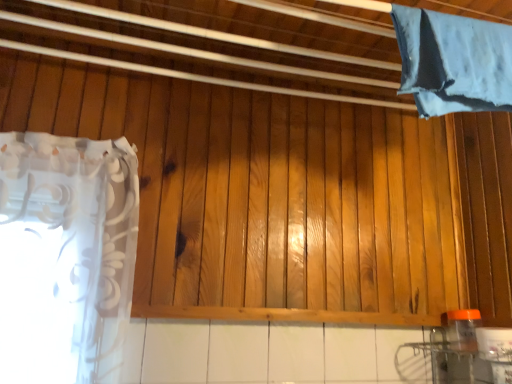
What do you see at coordinates (66, 257) in the screenshot?
I see `white sheer curtain at left, arranged as the 1th curtain when viewed from the left` at bounding box center [66, 257].

What is the approximate width of orange translucent bottle at lower right?

orange translucent bottle at lower right is 2.65 inches in width.

Image resolution: width=512 pixels, height=384 pixels. Find the location of `blue fabric at upper right, the 1th curtain from the top`. blue fabric at upper right, the 1th curtain from the top is located at coordinates (453, 62).

Between white sheer curtain at left, the second curtain from the top, and blue fabric at upper right, which appears as the 1th curtain when viewed from the right, which one has larger size?

With larger size is white sheer curtain at left, the second curtain from the top.

Can you tell me how much white sheer curtain at left, acting as the second curtain starting from the right, and blue fabric at upper right, which appears as the 1th curtain when viewed from the right, differ in facing direction?

There is a 3.81-degree angle between the facing directions of white sheer curtain at left, acting as the second curtain starting from the right, and blue fabric at upper right, which appears as the 1th curtain when viewed from the right.

Is white sheer curtain at left, the second curtain from the top, far from blue fabric at upper right, which appears as the 1th curtain when viewed from the right?

They are positioned close to each other.

From a real-world perspective, who is located lower, orange translucent bottle at lower right or white sheer curtain at left, which ranks as the 1th curtain in bottom-to-top order?

In real-world perspective, orange translucent bottle at lower right is lower.

Considering the points (471, 324) and (66, 228), which point is in front, point (471, 324) or point (66, 228)?

The point (66, 228) is in front.

Measure the distance between orange translucent bottle at lower right and white sheer curtain at left, arranged as the 1th curtain when viewed from the left.

orange translucent bottle at lower right is 39.35 inches away from white sheer curtain at left, arranged as the 1th curtain when viewed from the left.

From the image's perspective, is orange translucent bottle at lower right under white sheer curtain at left, which ranks as the 1th curtain in bottom-to-top order?

Yes.

Locate an element on the screen. bottle lying on the right of white sheer curtain at left, arranged as the 1th curtain when viewed from the left is located at coordinates (463, 329).

From the picture: Which is more to the right, white sheer curtain at left, acting as the second curtain starting from the right, or orange translucent bottle at lower right?

Positioned to the right is orange translucent bottle at lower right.

Is white sheer curtain at left, which ranks as the 1th curtain in bottom-to-top order, oriented away from orange translucent bottle at lower right?

No, white sheer curtain at left, which ranks as the 1th curtain in bottom-to-top order,'s orientation is not away from orange translucent bottle at lower right.

Considering the points (469, 346) and (416, 65), which point is behind, point (469, 346) or point (416, 65)?

Point (469, 346)

Is orange translucent bottle at lower right aimed at blue fabric at upper right, placed as the 2th curtain when sorted from left to right?

No, orange translucent bottle at lower right does not turn towards blue fabric at upper right, placed as the 2th curtain when sorted from left to right.

Considering the relative sizes of orange translucent bottle at lower right and blue fabric at upper right, placed as the 2th curtain when sorted from left to right, in the image provided, is orange translucent bottle at lower right smaller than blue fabric at upper right, placed as the 2th curtain when sorted from left to right,?

Yes.

From a real-world perspective, is blue fabric at upper right, which appears as the 1th curtain when viewed from the right, below white sheer curtain at left, acting as the second curtain starting from the right?

No, from a real-world perspective, blue fabric at upper right, which appears as the 1th curtain when viewed from the right, is not below white sheer curtain at left, acting as the second curtain starting from the right.

From the image's perspective, is blue fabric at upper right, which appears as the 1th curtain when viewed from the right, on top of white sheer curtain at left, which ranks as the 1th curtain in bottom-to-top order?

Correct, blue fabric at upper right, which appears as the 1th curtain when viewed from the right, appears higher than white sheer curtain at left, which ranks as the 1th curtain in bottom-to-top order, in the image.

Does blue fabric at upper right, the 1th curtain from the top, have a smaller size compared to white sheer curtain at left, which ranks as the 1th curtain in bottom-to-top order?

Yes.

Which object is further away from the camera, blue fabric at upper right, placed as the 2th curtain when sorted from left to right, or orange translucent bottle at lower right?

orange translucent bottle at lower right.

Considering the points (490, 63) and (470, 311), which point is in front, point (490, 63) or point (470, 311)?

The point (490, 63) is closer to the camera.

In the scene shown: Does blue fabric at upper right, the 1th curtain from the top, have a lesser height compared to orange translucent bottle at lower right?

No.

Find the location of a particular element. The width and height of the screenshot is (512, 384). bottle lying below the blue fabric at upper right, the 1th curtain from the top (from the image's perspective) is located at coordinates (463, 329).

I want to click on curtain to the right of white sheer curtain at left, arranged as the 1th curtain when viewed from the left, so click(x=453, y=62).

At what (x,y) coordinates should I click in order to perform the action: click on bottle behind the white sheer curtain at left, the second curtain from the top. Please return your answer as a coordinate pair (x, y). The width and height of the screenshot is (512, 384). Looking at the image, I should click on (463, 329).

Which object lies further to the anchor point orange translucent bottle at lower right, blue fabric at upper right, the 1th curtain from the top, or white sheer curtain at left, acting as the second curtain starting from the right?

white sheer curtain at left, acting as the second curtain starting from the right, lies further to orange translucent bottle at lower right than the other object.

From the image, which object appears to be nearer to blue fabric at upper right, acting as the second curtain starting from the bottom, white sheer curtain at left, the second curtain from the top, or orange translucent bottle at lower right?

orange translucent bottle at lower right is positioned closer to the anchor blue fabric at upper right, acting as the second curtain starting from the bottom.

Consider the image. Which object lies nearer to the anchor point blue fabric at upper right, the 1th curtain from the top, orange translucent bottle at lower right or white sheer curtain at left, arranged as the 1th curtain when viewed from the left?

Among the two, orange translucent bottle at lower right is located nearer to blue fabric at upper right, the 1th curtain from the top.

Estimate the real-world distances between objects in this image. Which object is closer to white sheer curtain at left, acting as the second curtain starting from the right, orange translucent bottle at lower right or blue fabric at upper right, placed as the 2th curtain when sorted from left to right?

blue fabric at upper right, placed as the 2th curtain when sorted from left to right.

Estimate the real-world distances between objects in this image. Which object is further from white sheer curtain at left, which ranks as the 1th curtain in bottom-to-top order, blue fabric at upper right, acting as the second curtain starting from the bottom, or orange translucent bottle at lower right?

orange translucent bottle at lower right lies further to white sheer curtain at left, which ranks as the 1th curtain in bottom-to-top order, than the other object.

Based on their spatial positions, is white sheer curtain at left, arranged as the 1th curtain when viewed from the left, or blue fabric at upper right, placed as the 2th curtain when sorted from left to right, closer to orange translucent bottle at lower right?

blue fabric at upper right, placed as the 2th curtain when sorted from left to right, is positioned closer to the anchor orange translucent bottle at lower right.

Find the location of a particular element. Image resolution: width=512 pixels, height=384 pixels. curtain between white sheer curtain at left, which ranks as the 1th curtain in bottom-to-top order, and orange translucent bottle at lower right, in the horizontal direction is located at coordinates (453, 62).